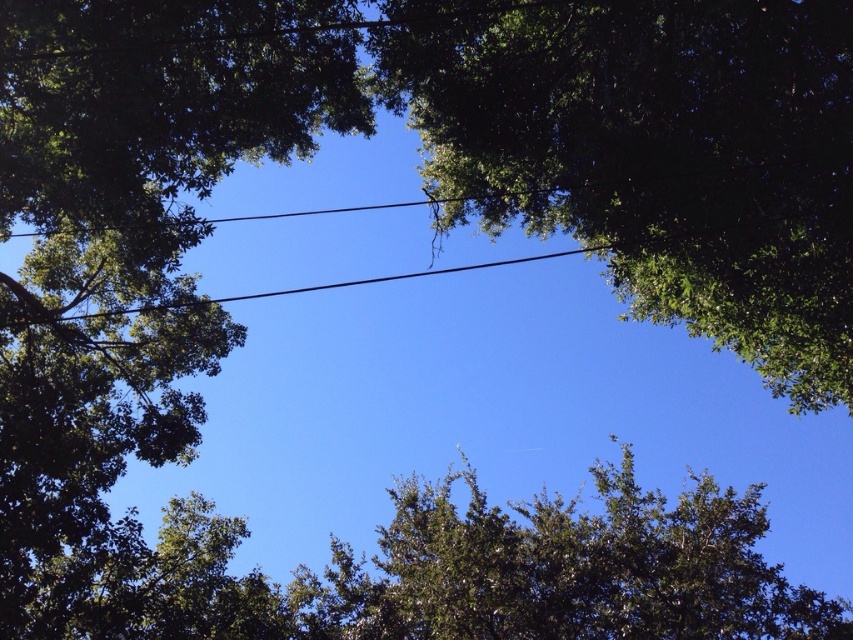
Which is behind, point (830, 241) or point (804, 596)?

Positioned behind is point (804, 596).

Which is in front, point (567, 86) or point (640, 634)?

Point (567, 86) is in front.

Is point (578, 10) less distant than point (306, 600)?

That is True.

This screenshot has height=640, width=853. I want to click on green leafy tree at upper center, so click(654, 156).